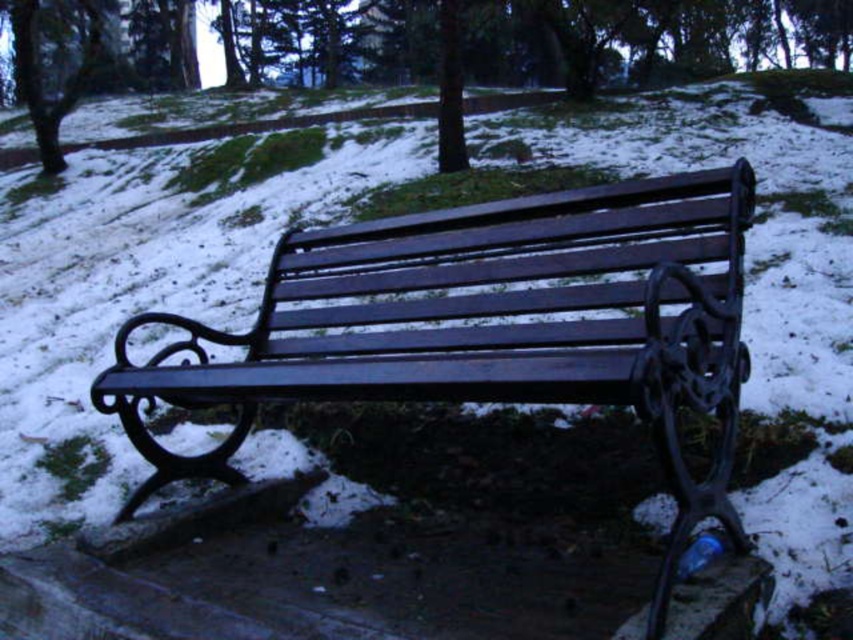
Question: Which point is farther to the camera?

Choices:
 (A) (425, 51)
 (B) (53, 72)

Answer: (A)

Question: Does green matte tree at center have a smaller size compared to smooth bark tree at upper left?

Choices:
 (A) yes
 (B) no

Answer: (A)

Question: Where is green matte tree at center located in relation to smooth bark tree at upper left in the image?

Choices:
 (A) below
 (B) above

Answer: (A)

Question: Which of the following is the farthest from the observer?

Choices:
 (A) (25, 83)
 (B) (595, 28)

Answer: (B)

Question: Is green matte tree at center below smooth bark tree at upper left?

Choices:
 (A) yes
 (B) no

Answer: (A)